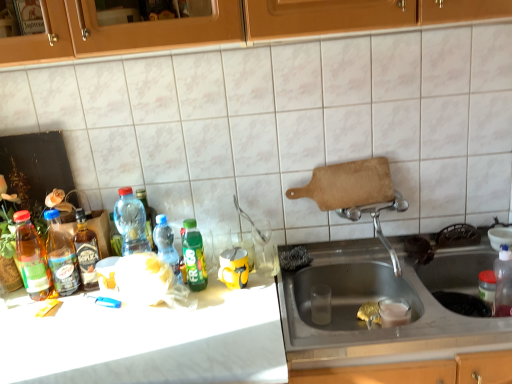
Question: From the image's perspective, is translucent glass bottle at left, the fifth bottle when ordered from right to left, positioned above or below stainless steel sink at lower right?

Choices:
 (A) above
 (B) below

Answer: (A)

Question: Based on their sizes in the image, would you say translucent glass bottle at left, the fifth bottle when ordered from right to left, is bigger or smaller than stainless steel sink at lower right?

Choices:
 (A) small
 (B) big

Answer: (A)

Question: Which object is the closest to the translucent glass bottle at left, the fifth bottle when ordered from right to left?

Choices:
 (A) green matte bottle at center, which is counted as the sixth bottle, starting from the left
 (B) translucent plastic bottle at center-left, the fourth bottle from the left
 (C) translucent plastic bottle at sink right, the 1th bottle in the right-to-left sequence
 (D) translucent plastic bottle at left, which ranks as the 1th bottle in left-to-right order
 (E) translucent plastic bottle at left, the 6th bottle positioned from the right

Answer: (E)

Question: Which object is positioned closest to the translucent plastic bottle at sink right, the 1th bottle in the right-to-left sequence?

Choices:
 (A) translucent plastic bottle at center, positioned as the 3th bottle in right-to-left order
 (B) translucent glass bottle at left, the fifth bottle when ordered from right to left
 (C) white marble countertop at center
 (D) stainless steel sink at lower right
 (E) translucent plastic bottle at left, the 6th bottle positioned from the right

Answer: (D)